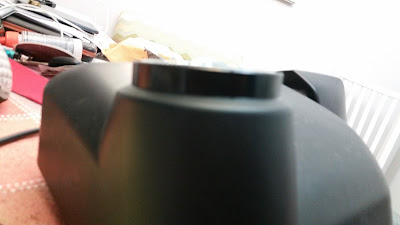
Identify the location of basket. This screenshot has height=225, width=400. (122, 48).